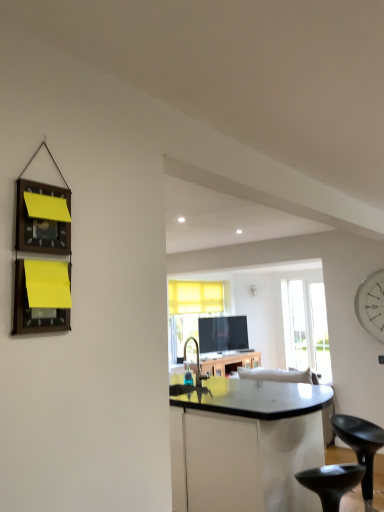
What is the approximate height of white fabric couch at center?

The height of white fabric couch at center is 33.29 inches.

Identify the location of white fabric couch at center. tap(278, 375).

What do you see at coordinates (296, 324) in the screenshot?
I see `transparent glass door at center` at bounding box center [296, 324].

The width and height of the screenshot is (384, 512). What do you see at coordinates (361, 447) in the screenshot?
I see `black plastic stool at lower right, placed as the 1th stool when sorted from right to left` at bounding box center [361, 447].

At what (x,y) coordinates should I click in order to perform the action: click on translucent glass table at center. Please return your answer as a coordinate pair (x, y). This screenshot has width=384, height=512. Looking at the image, I should click on (229, 362).

The height and width of the screenshot is (512, 384). I want to click on white glossy clock at right, so click(371, 304).

Describe the element at coordinates (331, 482) in the screenshot. The image size is (384, 512). I see `black plastic stool at lower right, the 2th stool from the right` at that location.

I want to click on white fabric couch at center, so click(x=278, y=375).

Is white glossy clock at right at the left side of translucent glass table at center?

No.

Is point (381, 338) behind point (233, 362)?

That is False.

Is white glossy clock at right next to translucent glass table at center and touching it?

No.

Between white glossy clock at right and translucent glass table at center, which one has more height?

Standing taller between the two is white glossy clock at right.

Does translucent glass table at center have a lesser height compared to matte silver faucet at center?

In fact, translucent glass table at center may be taller than matte silver faucet at center.

From a real-world perspective, is translucent glass table at center physically located above or below matte silver faucet at center?

From a real-world perspective, translucent glass table at center is physically below matte silver faucet at center.

Could you tell me if translucent glass table at center is turned towards matte silver faucet at center?

No, translucent glass table at center does not turn towards matte silver faucet at center.

Does translucent glass table at center touch matte silver faucet at center?

No, translucent glass table at center is not in contact with matte silver faucet at center.

Locate an element on the screen. This screenshot has width=384, height=512. stool that is the 2nd object located in front of the translucent glass table at center is located at coordinates (331, 482).

Which of these two, translucent glass table at center or black plastic stool at lower right, the 2th stool from the right, is smaller?

black plastic stool at lower right, the 2th stool from the right.

Between translucent glass table at center and black plastic stool at lower right, which is the 1th stool from left to right, which one has larger width?

translucent glass table at center is wider.

Is black plastic stool at lower right, the second stool in the left-to-right sequence, looking in the opposite direction of white glossy clock at right?

No, black plastic stool at lower right, the second stool in the left-to-right sequence, is not facing the opposite direction of white glossy clock at right.

What are the coordinates of `clock above the black plastic stool at lower right, the second stool in the left-to-right sequence (from the image's perspective)` in the screenshot? It's located at (371, 304).

Is black plastic stool at lower right, the second stool in the left-to-right sequence, inside or outside of white glossy clock at right?

The correct answer is: outside.

From the image's perspective, which is below, translucent glass table at center or wooden frame at left?

From the image's view, translucent glass table at center is below.

Who is bigger, translucent glass table at center or wooden frame at left?

With larger size is translucent glass table at center.

Which point is more distant from viewer, [224,358] or [25,229]?

The point [224,358] is more distant.

From a real-world perspective, which is physically below, translucent glass table at center or wooden frame at left?

translucent glass table at center is physically lower.

Does white glossy clock at right have a lesser width compared to matte silver faucet at center?

Yes, white glossy clock at right is thinner than matte silver faucet at center.

Find the location of a particular element. This screenshot has height=512, width=384. faucet below the white glossy clock at right (from a real-world perspective) is located at coordinates (197, 362).

Is white glossy clock at right positioned in front of matte silver faucet at center?

No, white glossy clock at right is further to the viewer.

Can we say white glossy clock at right lies outside matte silver faucet at center?

Yes, white glossy clock at right is not within matte silver faucet at center.

Is point (277, 375) closer to camera compared to point (213, 370)?

That is True.

Based on the photo, from the image's perspective, which is above, white fabric couch at center or translucent glass table at center?

From the image's view, white fabric couch at center is above.

Is white fabric couch at center oriented towards translucent glass table at center?

No.

Where is `table that appears behind the white glossy clock at right`? This screenshot has width=384, height=512. table that appears behind the white glossy clock at right is located at coordinates (229, 362).

Locate an element on the screen. The width and height of the screenshot is (384, 512). table that appears on the right of matte silver faucet at center is located at coordinates (229, 362).

Considering their positions, is translucent glass table at center positioned further to wooden frame at left than transparent glass door at center?

Based on the image, transparent glass door at center appears to be further to wooden frame at left.

From the image, which object appears to be farther from translucent glass table at center, transparent glass door at center or white fabric couch at center?

The object further to translucent glass table at center is white fabric couch at center.

Looking at the image, which one is located further to transparent glass door at center, wooden frame at left or white fabric couch at center?

Based on the image, wooden frame at left appears to be further to transparent glass door at center.

Estimate the real-world distances between objects in this image. Which object is further from matte silver faucet at center, black plastic stool at lower right, the 2th stool from the right, or white glossy clock at right?

Among the two, white glossy clock at right is located further to matte silver faucet at center.

In the scene shown: Looking at the image, which one is located further to matte silver faucet at center, white glossy clock at right or transparent glass door at center?

The object further to matte silver faucet at center is white glossy clock at right.

From the image, which object appears to be nearer to black plastic stool at lower right, the second stool in the left-to-right sequence, black plastic stool at lower right, the 2th stool from the right, or white glossy clock at right?

black plastic stool at lower right, the 2th stool from the right, is positioned closer to the anchor black plastic stool at lower right, the second stool in the left-to-right sequence.

Which object lies further to the anchor point matte silver faucet at center, white fabric couch at center or transparent glass door at center?

transparent glass door at center is further to matte silver faucet at center.

Based on their spatial positions, is translucent glass table at center or black plastic stool at lower right, which is the 1th stool from left to right, closer to wooden frame at left?

The object closer to wooden frame at left is black plastic stool at lower right, which is the 1th stool from left to right.

This screenshot has width=384, height=512. Find the location of `clock located between matte silver faucet at center and translucent glass table at center in the depth direction`. clock located between matte silver faucet at center and translucent glass table at center in the depth direction is located at coordinates (371, 304).

This screenshot has height=512, width=384. I want to click on stool located between black plastic stool at lower right, which is the 1th stool from left to right, and matte silver faucet at center in the depth direction, so click(x=361, y=447).

You are a GUI agent. You are given a task and a screenshot of the screen. Output one action in this format:
    pyautogui.click(x=<x>, y=<y>)
    Task: Click on the table located between black plastic stool at lower right, placed as the 1th stool when sorted from right to left, and transparent glass door at center in the depth direction
    The height and width of the screenshot is (512, 384).
    Given the screenshot: What is the action you would take?
    pyautogui.click(x=229, y=362)

This screenshot has height=512, width=384. Identify the location of stool between black plastic stool at lower right, the 2th stool from the right, and transparent glass door at center, along the z-axis. (361, 447).